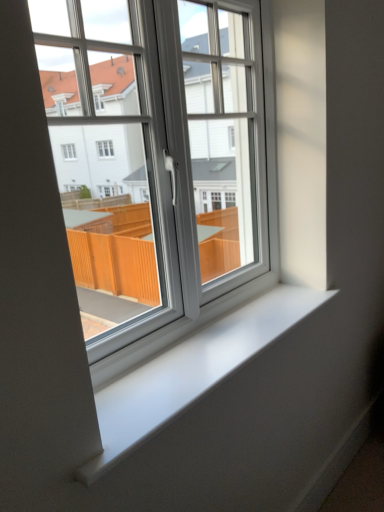
Question: Considering the positions of white plastic window at center and white smooth window sill at center in the image, is white plastic window at center bigger or smaller than white smooth window sill at center?

Choices:
 (A) small
 (B) big

Answer: (B)

Question: Looking at their shapes, would you say white plastic window at center is wider or thinner than white smooth window sill at center?

Choices:
 (A) wide
 (B) thin

Answer: (B)

Question: Is white plastic window at center to the left or to the right of white smooth window sill at center in the image?

Choices:
 (A) left
 (B) right

Answer: (A)

Question: Considering the relative positions of white smooth window sill at center and white plastic window at center in the image provided, is white smooth window sill at center to the left or to the right of white plastic window at center?

Choices:
 (A) left
 (B) right

Answer: (B)

Question: Looking at their shapes, would you say white smooth window sill at center is wider or thinner than white plastic window at center?

Choices:
 (A) wide
 (B) thin

Answer: (A)

Question: Is white smooth window sill at center spatially inside white plastic window at center, or outside of it?

Choices:
 (A) inside
 (B) outside

Answer: (B)

Question: From a real-world perspective, is white smooth window sill at center above or below white plastic window at center?

Choices:
 (A) below
 (B) above

Answer: (A)